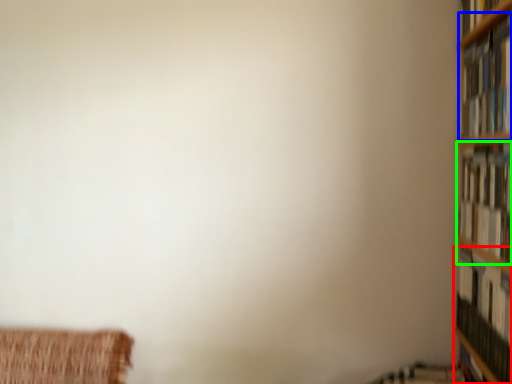
Question: Based on their relative distances, which object is farther from book (highlighted by a red box)? Choose from book (highlighted by a blue box) and book (highlighted by a green box).

Choices:
 (A) book
 (B) book

Answer: (A)